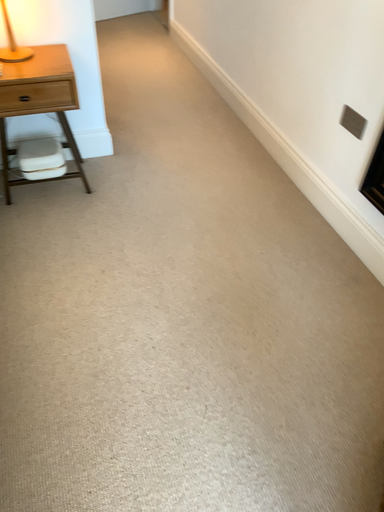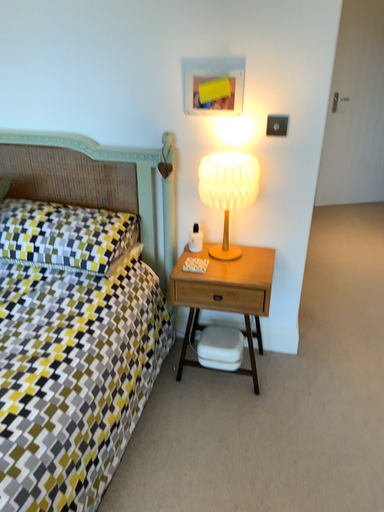
Question: Which way did the camera rotate in the video?

Choices:
 (A) rotated downward
 (B) rotated upward

Answer: (B)